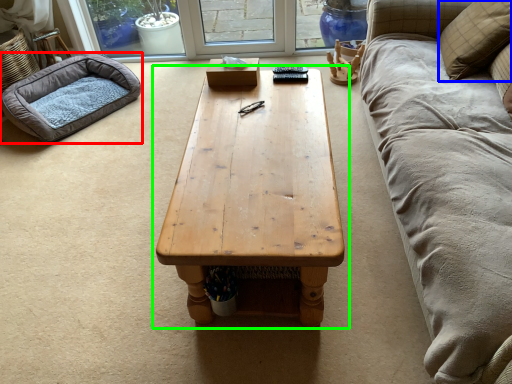
Question: Based on their relative distances, which object is farther from dog bed (highlighted by a red box)? Choose from pillow (highlighted by a blue box) and coffee table (highlighted by a green box).

Choices:
 (A) pillow
 (B) coffee table

Answer: (A)